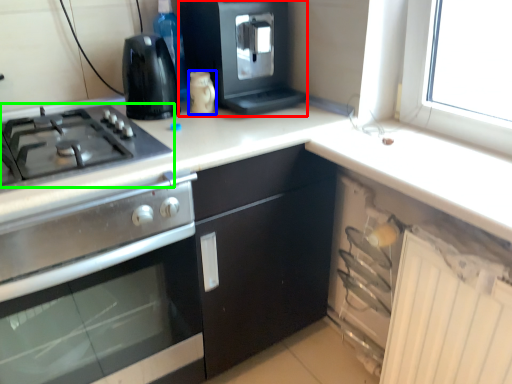
Question: Which object is the farthest from kitchen appliance (highlighted by a red box)? Choose among these: kitchen appliance (highlighted by a blue box) or gas stove (highlighted by a green box).

Choices:
 (A) kitchen appliance
 (B) gas stove

Answer: (B)